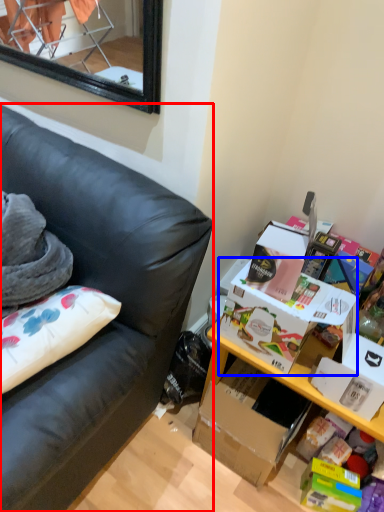
Question: Which point is further to the camera, studio couch (highlighted by a red box) or storage box (highlighted by a blue box)?

Choices:
 (A) studio couch
 (B) storage box

Answer: (B)